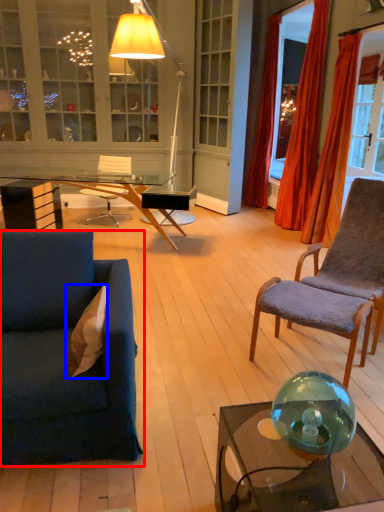
Question: Among these objects, which one is farthest to the camera, studio couch (highlighted by a red box) or pillow (highlighted by a blue box)?

Choices:
 (A) studio couch
 (B) pillow

Answer: (B)